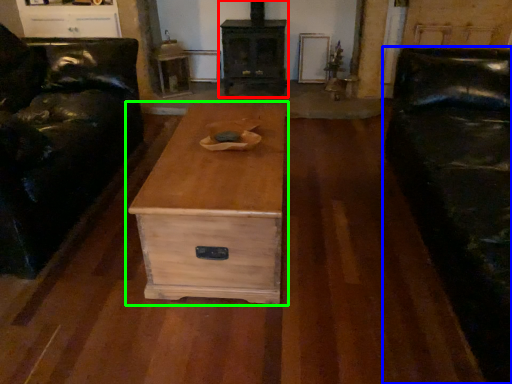
Question: Which object is positioned farthest from fireplace (highlighted by a red box)? Select from studio couch (highlighted by a blue box) and chest of drawers (highlighted by a green box).

Choices:
 (A) studio couch
 (B) chest of drawers

Answer: (B)